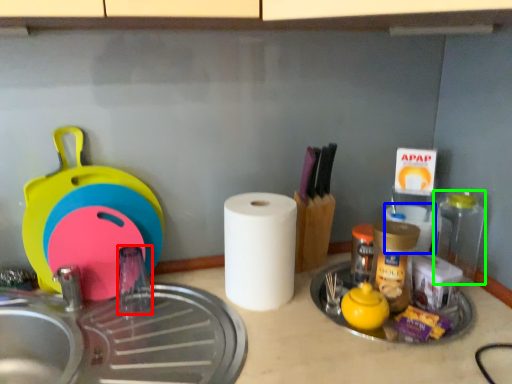
Question: Based on their relative distances, which object is farther from faucet (highlighted by a red box)? Choose from paper towel (highlighted by a blue box) and bottle (highlighted by a green box).

Choices:
 (A) paper towel
 (B) bottle

Answer: (B)